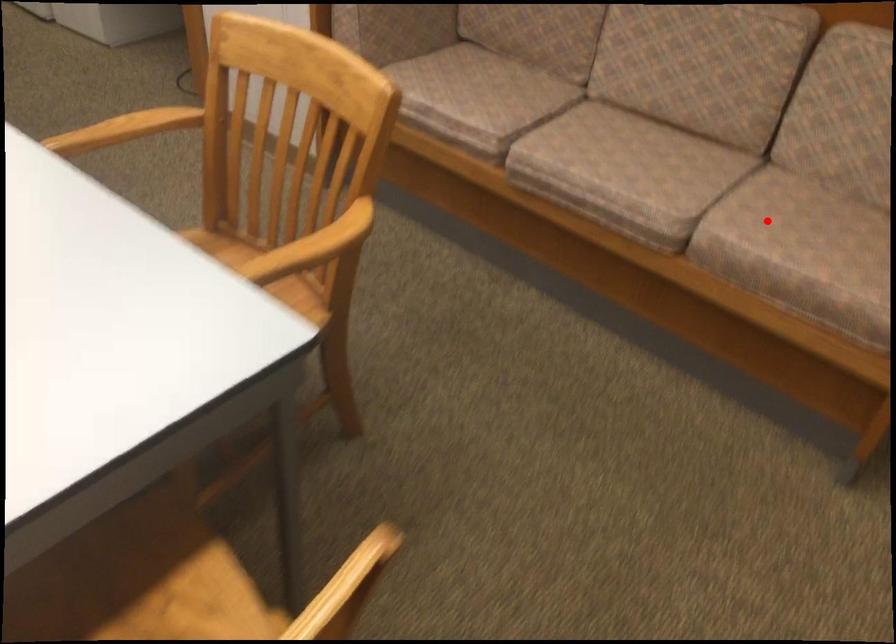
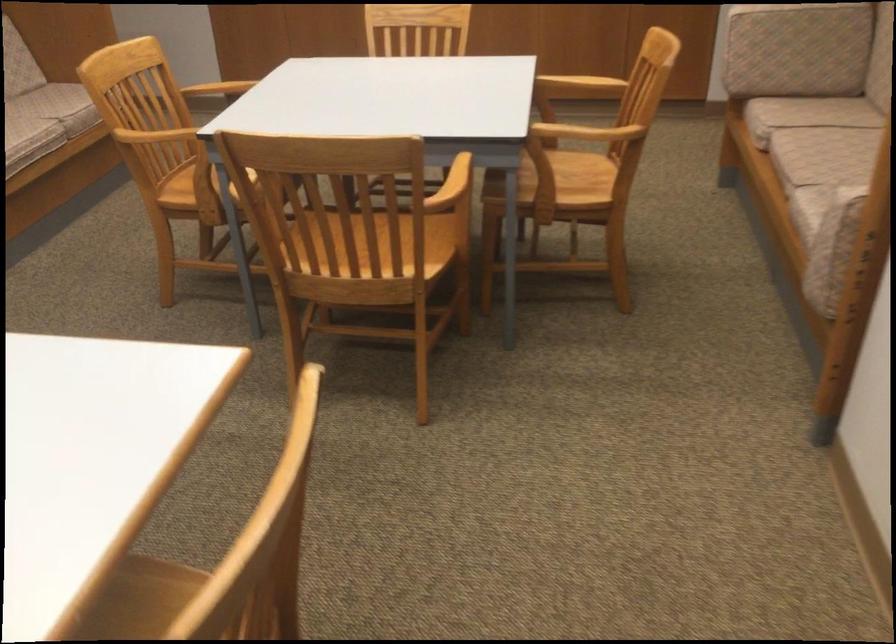
In the second image, find the point that corresponds to the highlighted location in the first image.

(58, 106)